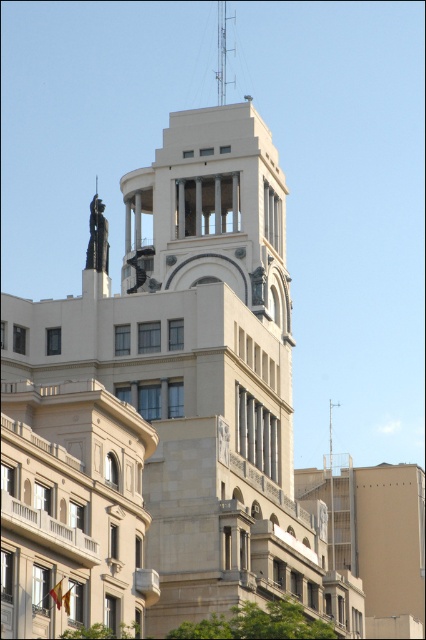
Is point (101, 220) positioned after point (138, 256)?

No, (101, 220) is in front of (138, 256).

Between polished bronze statue at upper center and satin bronze statue at upper center, which one is positioned higher?

polished bronze statue at upper center is higher up.

Image resolution: width=426 pixels, height=640 pixels. Find the location of `polished bronze statue at upper center`. polished bronze statue at upper center is located at coordinates (97, 236).

The width and height of the screenshot is (426, 640). What are the coordinates of `polished bronze statue at upper center` in the screenshot? It's located at (97, 236).

Is polished bronze statue at upper center to the left of metallic spire at upper center from the viewer's perspective?

Indeed, polished bronze statue at upper center is positioned on the left side of metallic spire at upper center.

Is point (100, 216) farther from viewer compared to point (219, 64)?

No, (100, 216) is in front of (219, 64).

Find the location of `polished bronze statue at upper center`. polished bronze statue at upper center is located at coordinates (97, 236).

Between metallic spire at upper center and satin bronze statue at upper center, which one appears on the left side from the viewer's perspective?

satin bronze statue at upper center

Can you confirm if metallic spire at upper center is shorter than satin bronze statue at upper center?

In fact, metallic spire at upper center may be taller than satin bronze statue at upper center.

Is point (218, 19) more distant than point (140, 273)?

That is True.

What are the coordinates of `metallic spire at upper center` in the screenshot? It's located at (222, 52).